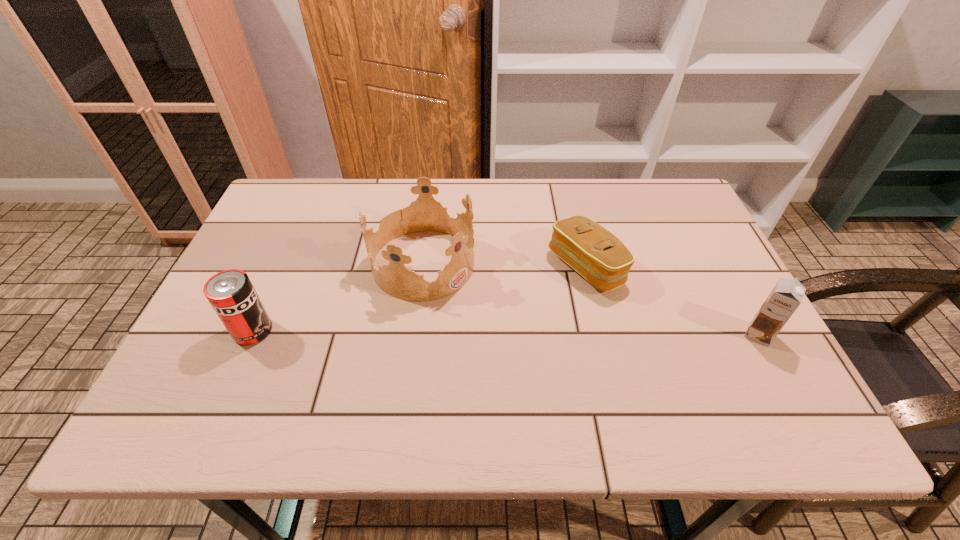
Locate an element on the screen. Image resolution: width=960 pixels, height=540 pixels. the leftmost object is located at coordinates (231, 294).

I want to click on the rightmost object, so click(x=786, y=296).

At what (x,y) coordinates should I click in order to perform the action: click on tiara. Please return your answer as a coordinate pair (x, y). This screenshot has width=960, height=540. Looking at the image, I should click on (424, 214).

The width and height of the screenshot is (960, 540). In order to click on the second object from right to left in this screenshot , I will do `click(600, 257)`.

You are a GUI agent. You are given a task and a screenshot of the screen. Output one action in this format:
    pyautogui.click(x=<x>, y=<y>)
    Task: Click on the shortest object
    The height and width of the screenshot is (540, 960).
    Given the screenshot: What is the action you would take?
    pyautogui.click(x=600, y=257)

Image resolution: width=960 pixels, height=540 pixels. What are the coordinates of `vacant region located on the left of the leftmost object` in the screenshot? It's located at (200, 331).

Locate an element on the screen. The image size is (960, 540). vacant space located 0.340m on the back of the rightmost object is located at coordinates [702, 230].

Find the location of `free location located on the front-facing side of the second object from left to right`. free location located on the front-facing side of the second object from left to right is located at coordinates (528, 332).

What are the coordinates of `free spot located 0.160m on the front-facing side of the second object from left to right` in the screenshot? It's located at (511, 321).

Find the location of a particular element. This screenshot has width=960, height=540. free space located on the front-facing side of the second object from left to right is located at coordinates (568, 359).